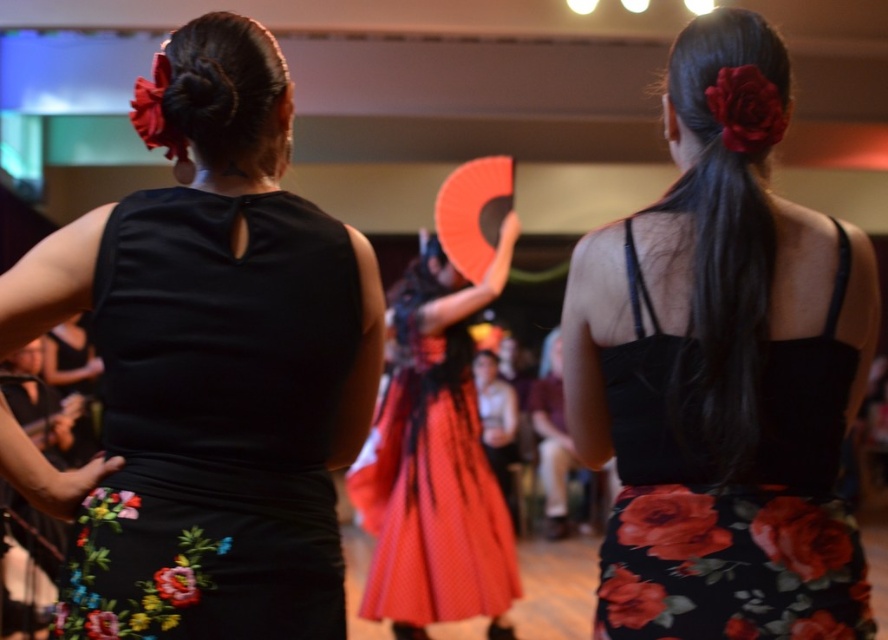
You are a photographer trying to capture the red dotted fabric dress at center and the black silky hair at upper center in the same frame. Which object should you focus on first to ensure both are in focus?

You should focus on the red dotted fabric dress at center first because it is closer to you than the black silky hair at upper center, so adjusting focus from the closer object to the farther one will help both be in focus.

You are a photographer at the flamenco performance. You need to capture a photo where both the black silky hair at upper center and the dark brown silky hair bun at upper left are visible. Based on their positions, which one should you adjust your camera to focus on first to ensure both are in frame?

The black silky hair at upper center is to the right of dark brown silky hair bun at upper left. To ensure both are in frame, focus on the dark brown silky hair bun at upper left first, as it is on the left side, then adjust the camera to include the black silky hair at upper center on the right.

You are a photographer standing at the back of the venue. You want to take a photo of the red dotted fabric dress at center and the black silky hair at upper center so that both are in focus. The camera you are using has a depth of field that can cover 10 feet. Will you be able to capture both subjects clearly in the same photo?

The distance between the red dotted fabric dress at center and the black silky hair at upper center is 11.27 feet. Since the camera can only cover 10 feet, the depth of field is insufficient to keep both subjects in focus simultaneously.